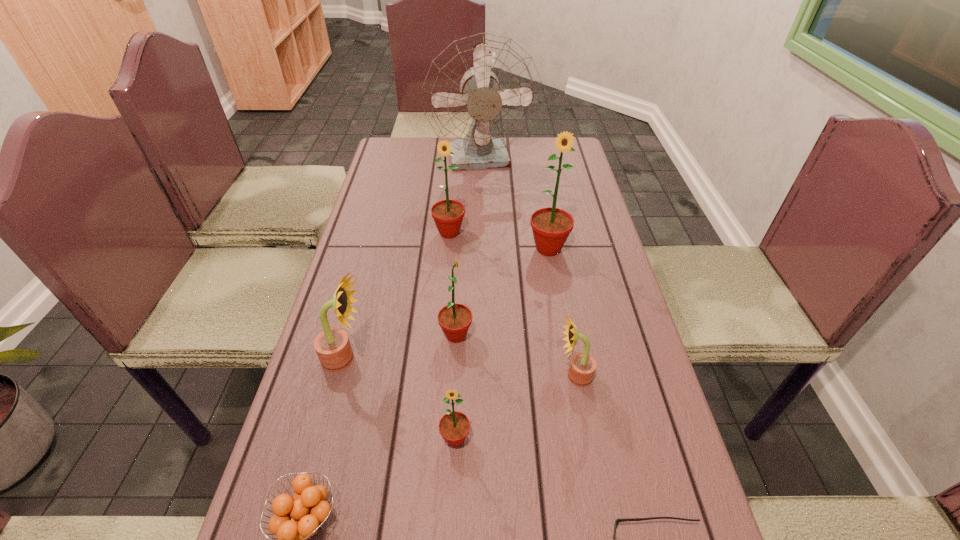
Locate an element on the screen. Image resolution: width=960 pixels, height=540 pixels. free space located 0.110m on the face of the smallest green sunflower is located at coordinates (452, 517).

In order to click on object at the far edge in this screenshot , I will do `click(482, 92)`.

The image size is (960, 540). I want to click on object present at the left edge, so click(332, 345).

This screenshot has width=960, height=540. What are the coordinates of `free region at the far edge of the desktop` in the screenshot? It's located at (524, 167).

At what (x,y) coordinates should I click in order to perform the action: click on vacant space at the left edge of the desktop. Please return your answer as a coordinate pair (x, y). Looking at the image, I should click on (326, 414).

At what (x,y) coordinates should I click in order to perform the action: click on free space at the right edge of the desktop. Please return your answer as a coordinate pair (x, y). This screenshot has width=960, height=540. Looking at the image, I should click on (697, 524).

Where is `empty location between the rightmost green sunflower and the bigger yellow sunflower`? This screenshot has height=540, width=960. empty location between the rightmost green sunflower and the bigger yellow sunflower is located at coordinates (446, 304).

Locate an element on the screen. vacant area between the right yellow sunflower and the second tallest object is located at coordinates (562, 313).

Find the location of a particular element. empty space that is in between the bigger yellow sunflower and the second biggest green sunflower is located at coordinates (397, 296).

You are a GUI agent. You are given a task and a screenshot of the screen. Output one action in this format:
    pyautogui.click(x=<x>, y=<y>)
    Task: Click on the vacant area that lies between the fifth shortest sunflower and the smaller yellow sunflower
    The width and height of the screenshot is (960, 540).
    Given the screenshot: What is the action you would take?
    pyautogui.click(x=512, y=305)